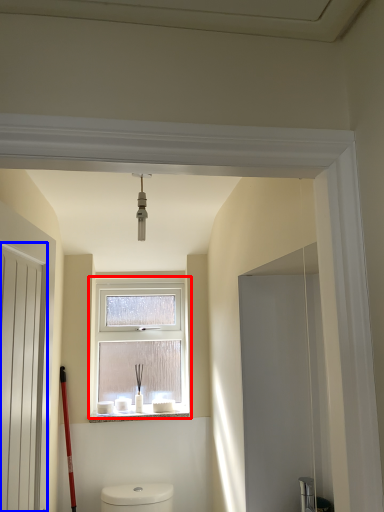
Question: Which point is further to the camera, window (highlighted by a red box) or screen door (highlighted by a blue box)?

Choices:
 (A) window
 (B) screen door

Answer: (A)